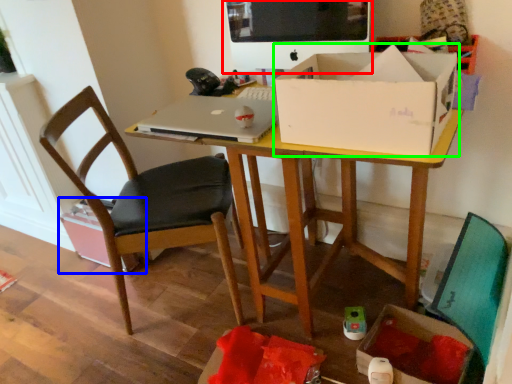
Question: Based on their relative distances, which object is nearer to computer monitor (highlighted by a red box)? Choose from cardboard box (highlighted by a blue box) and box (highlighted by a green box).

Choices:
 (A) cardboard box
 (B) box

Answer: (B)